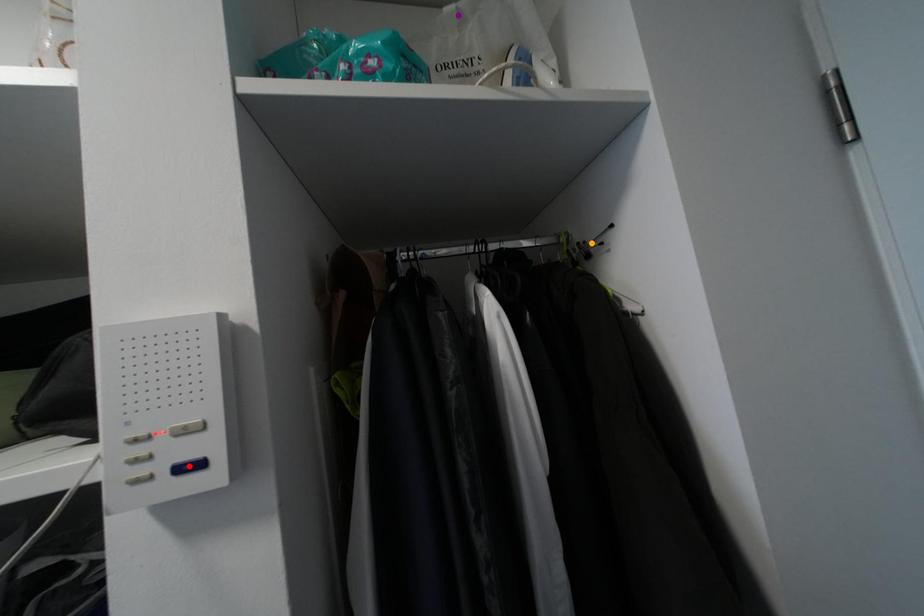
Order these from nearest to farthest:
1. purple point
2. orange point
3. red point

red point, purple point, orange point